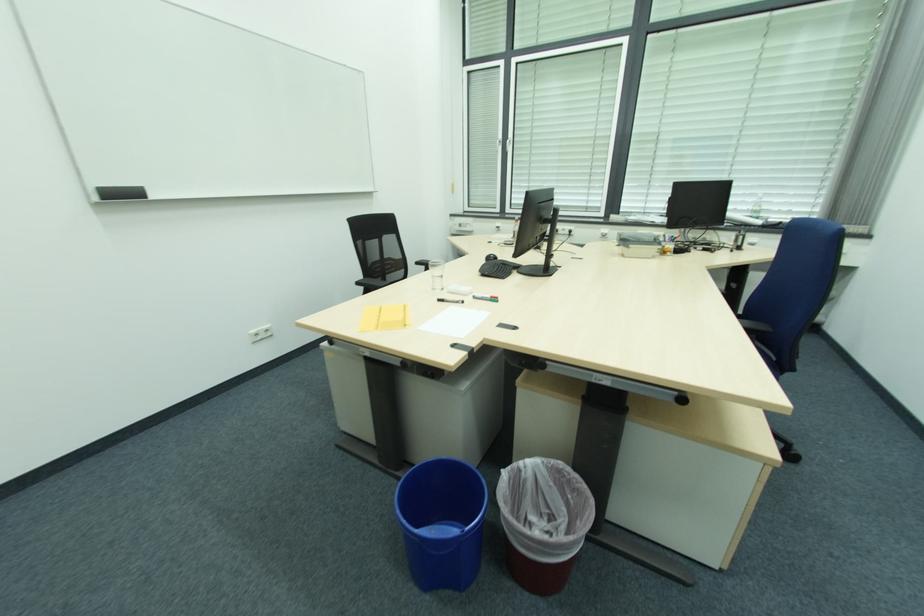
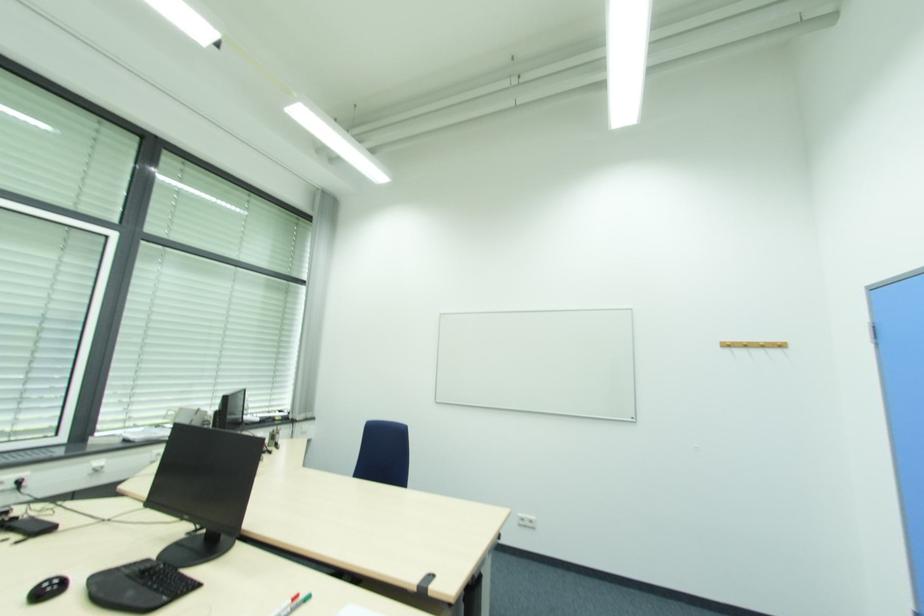
Locate, in the second image, the point that corresponds to point (499, 299) in the first image.

(298, 599)